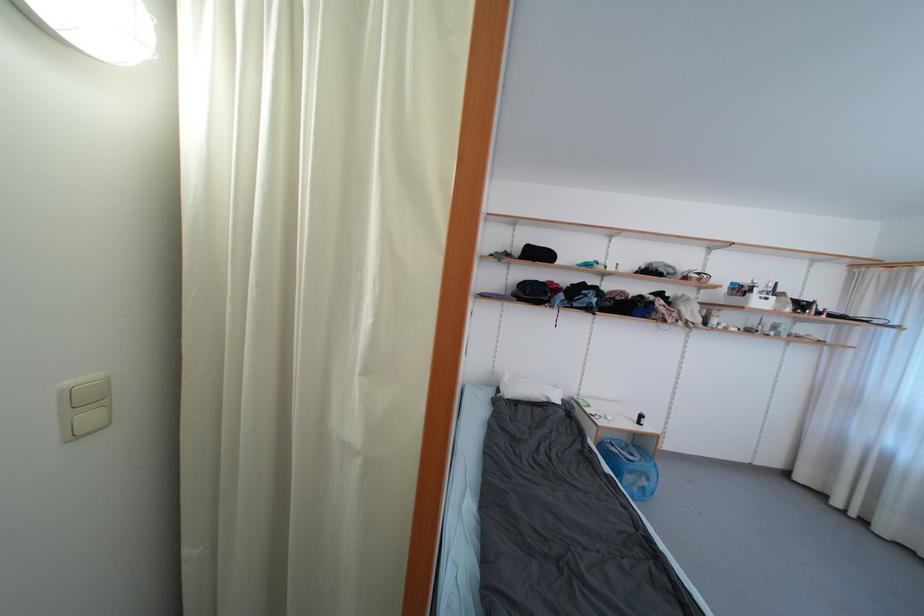
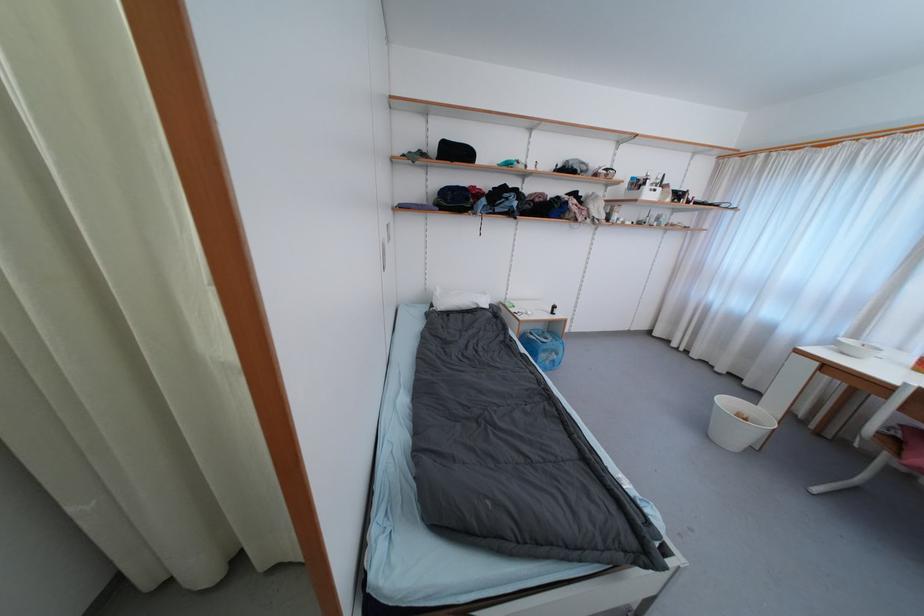
In the second image, find the point that corresponds to the point at 616,448 in the first image.

(535, 336)